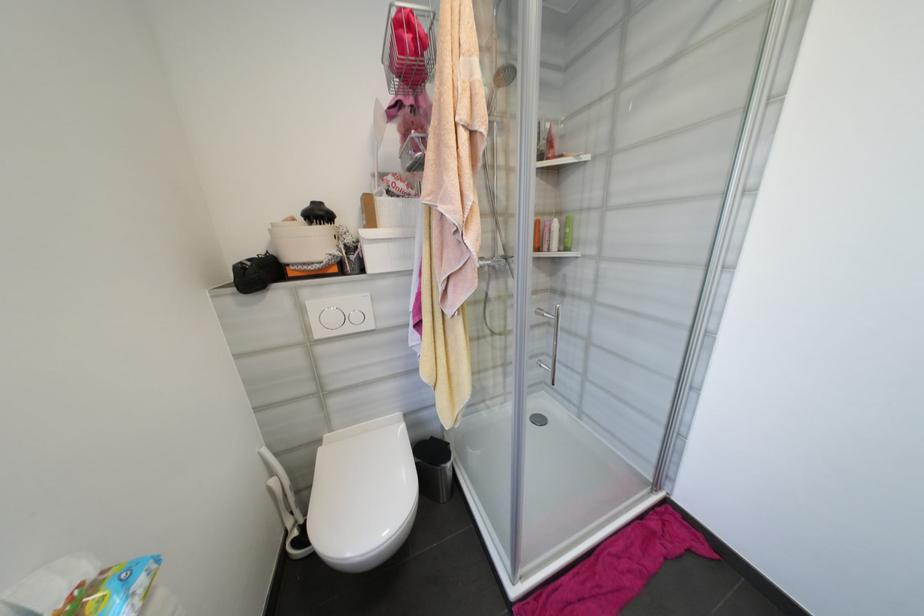
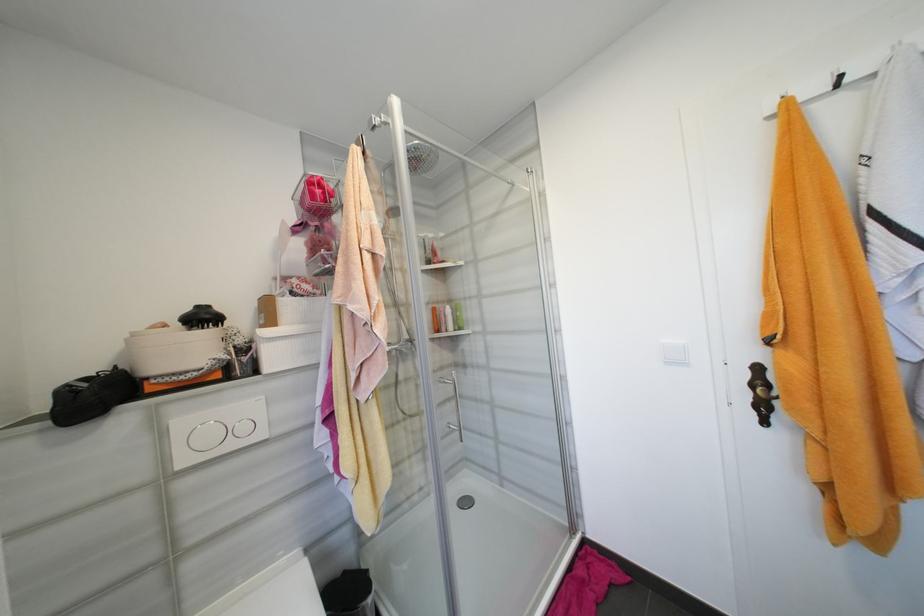
Question: In a continuous first-person perspective shot, in which direction is the camera moving?

Choices:
 (A) Left
 (B) Right
 (C) Forward
 (D) Backward

Answer: (D)